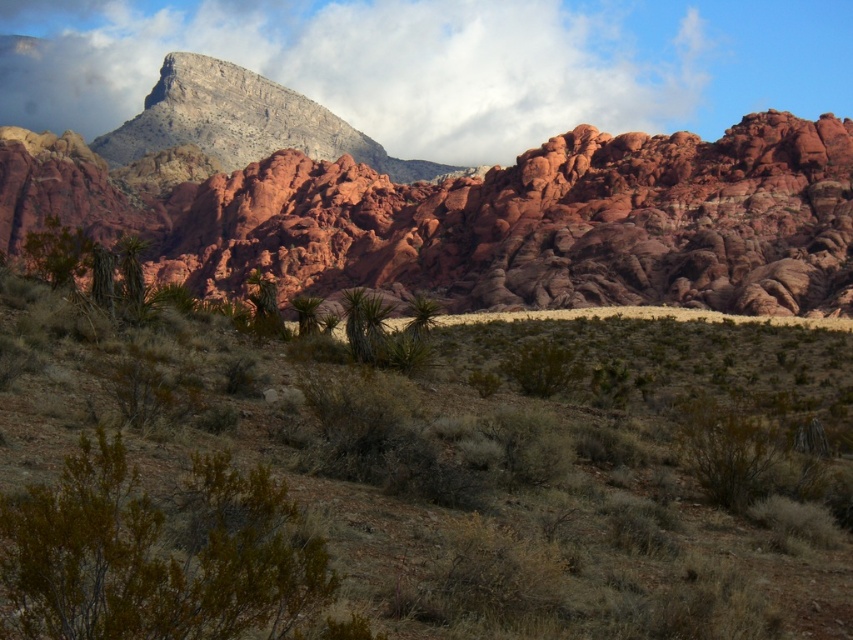
Who is shorter, brown shrubbery at center or cloudy sky at upper center?

Standing shorter between the two is brown shrubbery at center.

Where is `brown shrubbery at center`? The width and height of the screenshot is (853, 640). brown shrubbery at center is located at coordinates (403, 490).

I want to click on brown shrubbery at center, so click(x=403, y=490).

Does cloudy sky at upper center appear on the left side of green leafy bush at lower left?

Yes, cloudy sky at upper center is to the left of green leafy bush at lower left.

Who is more forward, (146, 84) or (198, 544)?

Positioned in front is point (198, 544).

Locate an element on the screen. This screenshot has height=640, width=853. cloudy sky at upper center is located at coordinates (363, 67).

Can you confirm if brown shrubbery at center is taller than reddish rock formation at upper center?

No, brown shrubbery at center is not taller than reddish rock formation at upper center.

Image resolution: width=853 pixels, height=640 pixels. What are the coordinates of `brown shrubbery at center` in the screenshot? It's located at (403, 490).

What do you see at coordinates (403, 490) in the screenshot? I see `brown shrubbery at center` at bounding box center [403, 490].

The image size is (853, 640). What are the coordinates of `brown shrubbery at center` in the screenshot? It's located at (403, 490).